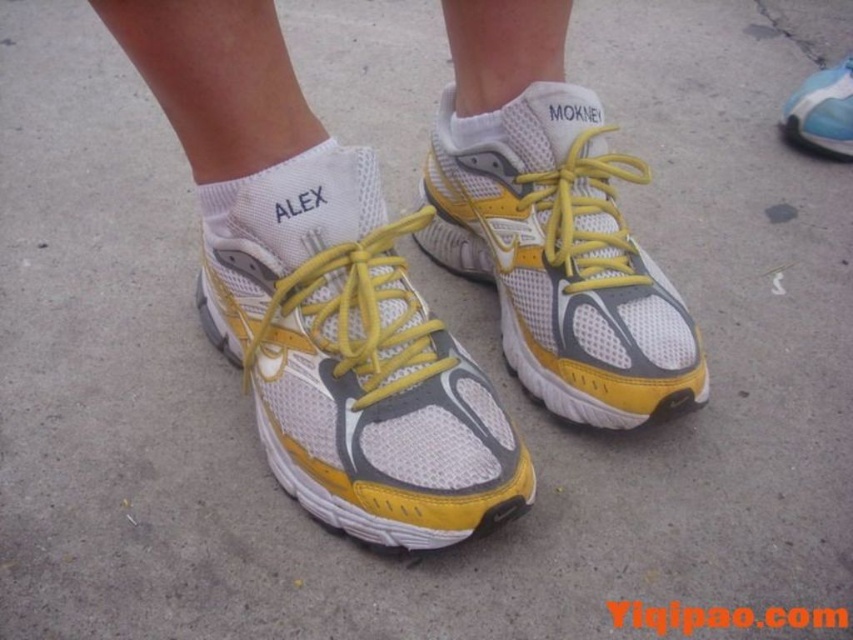
You are trying to put on your yellow mesh shoe at upper right. You notice a white fabric sock at center. Which item is wider?

The yellow mesh shoe at upper right is wider than the white fabric sock at center.

What object is located at the coordinates point (268, 192) in the image?

The white fabric sock at center is located at point (268, 192).

What are the coordinates of the yellow mesh running shoe at center?

The yellow mesh running shoe at center is located at coordinates (x=352, y=358).